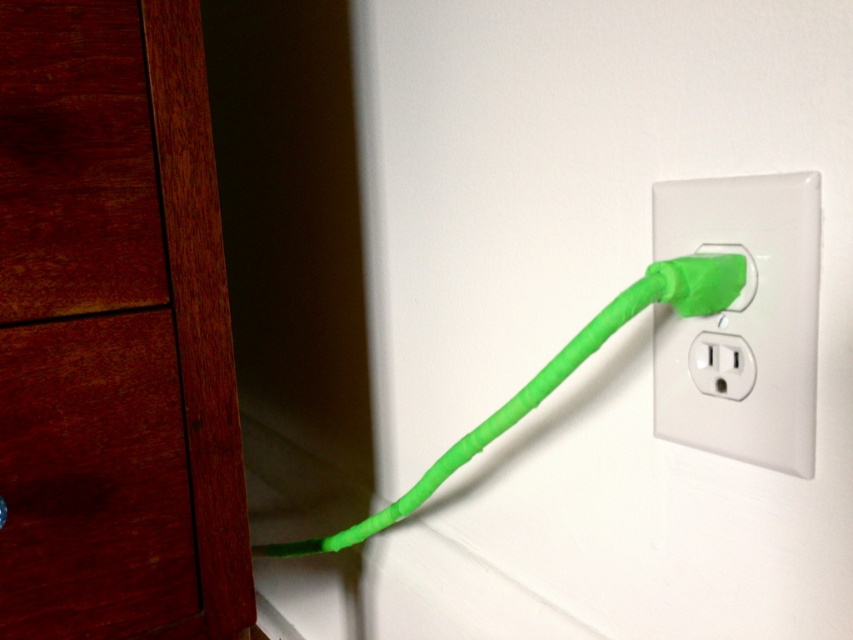
You are standing in front of the outlet and want to plug in a new device. The point where you need to reach is at coordinates point (212, 419). If your hand can extend 18 inches from your body, will you be able to reach that point without moving closer?

The point (212, 419) is 19.37 inches away from the viewer. Since your hand can only extend 18 inches, you will not be able to reach it without moving closer.

You have a new electronic device with a plug that is the same size as the green rubber plug at right. You want to place it on the mahogany wood drawer at left without overlapping. Is there enough space?

The mahogany wood drawer at left is wider than the green rubber plug at right, so there should be enough space to place the new device without overlapping.